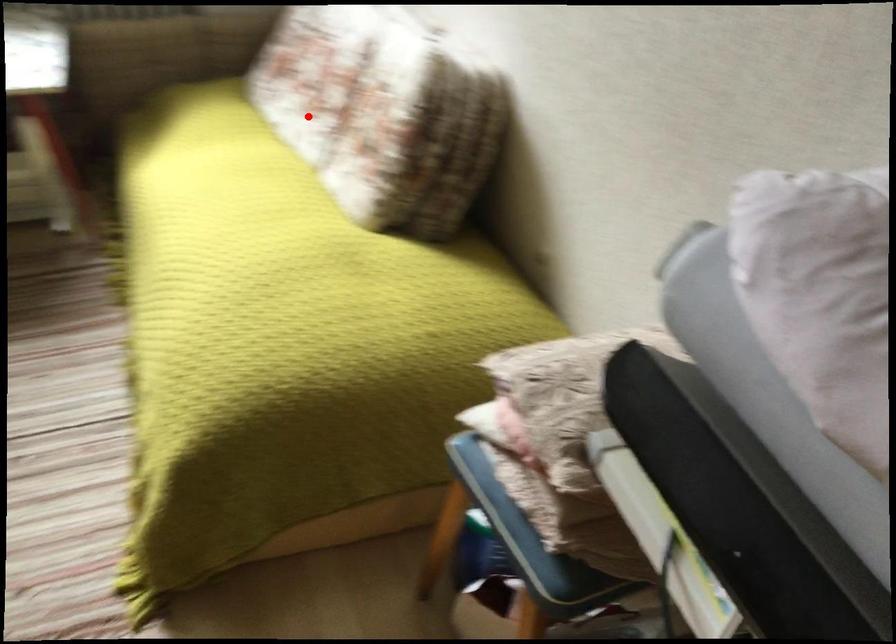
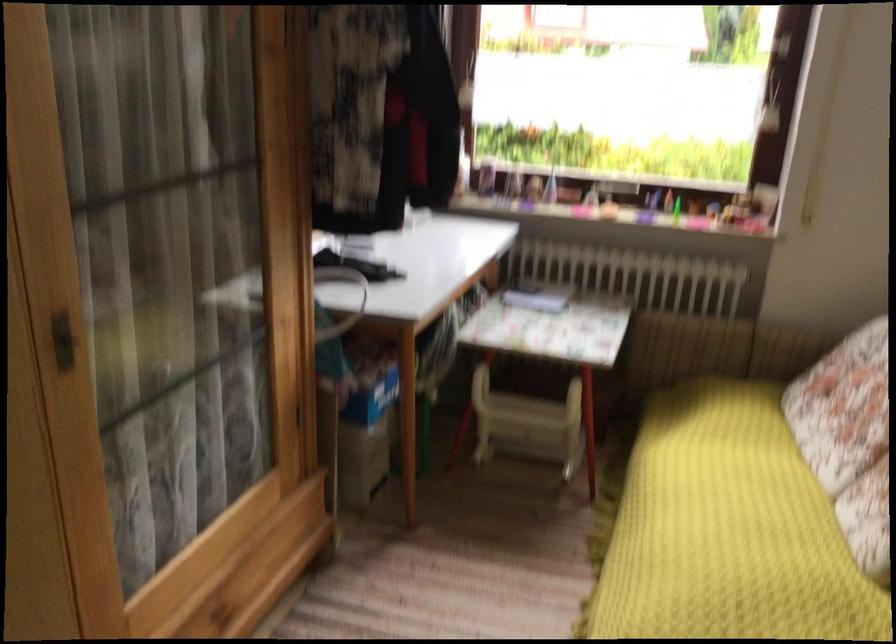
Where in the second image is the point corresponding to the highlighted location from the first image?

(849, 439)